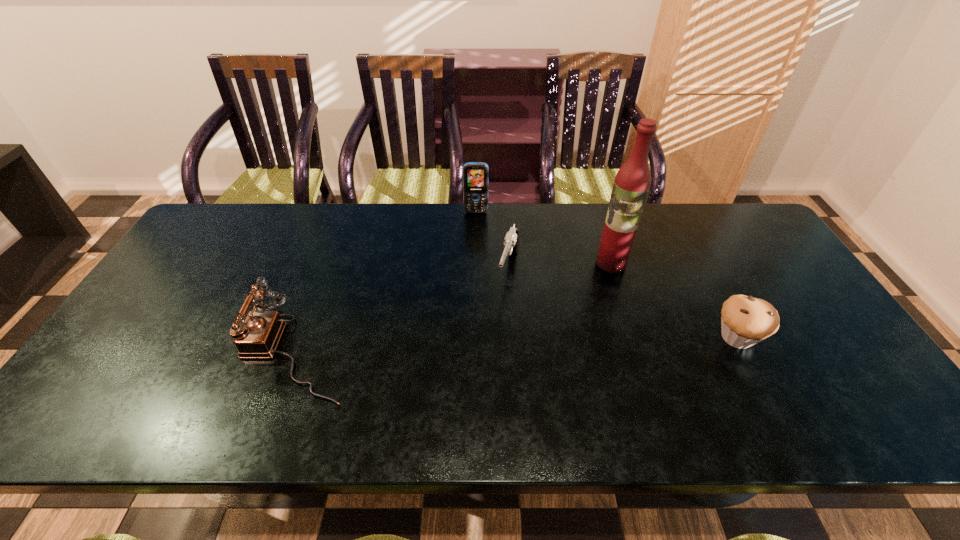
The height and width of the screenshot is (540, 960). Find the location of `cellular telephone located in the far edge section of the desktop`. cellular telephone located in the far edge section of the desktop is located at coordinates (475, 174).

I want to click on gun that is at the far edge, so click(x=511, y=241).

You are a GUI agent. You are given a task and a screenshot of the screen. Output one action in this format:
    pyautogui.click(x=<x>, y=<y>)
    Task: Click on the object present at the near edge
    
    Given the screenshot: What is the action you would take?
    pyautogui.click(x=257, y=337)

The width and height of the screenshot is (960, 540). I want to click on free region at the far edge of the desktop, so click(x=464, y=221).

The height and width of the screenshot is (540, 960). Find the location of `vacant space at the near edge`. vacant space at the near edge is located at coordinates (754, 371).

You are a GUI agent. You are given a task and a screenshot of the screen. Output one action in this format:
    pyautogui.click(x=<x>, y=<y>)
    Task: Click on the vacant region at the left edge of the desktop
    The height and width of the screenshot is (540, 960).
    Given the screenshot: What is the action you would take?
    pyautogui.click(x=160, y=309)

This screenshot has width=960, height=540. In the image, there is a desktop. What are the coordinates of `vacant area at the right edge` in the screenshot? It's located at (753, 258).

I want to click on vacant space at the far left corner of the desktop, so click(202, 236).

This screenshot has height=540, width=960. In order to click on free region at the far right corner in this screenshot , I will do `click(716, 233)`.

You are a GUI agent. You are given a task and a screenshot of the screen. Output one action in this format:
    pyautogui.click(x=<x>, y=<y>)
    Task: Click on the vacant area that lies between the rightmost object and the second tallest object
    
    Given the screenshot: What is the action you would take?
    pyautogui.click(x=607, y=275)